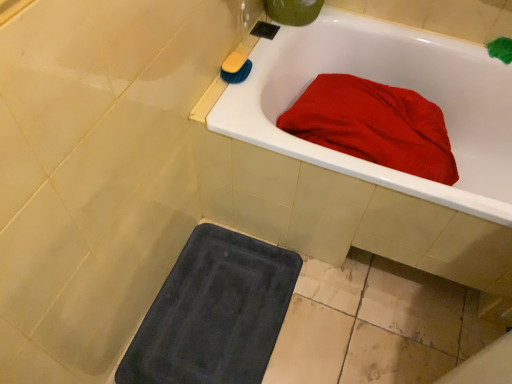
Identify the location of vacant area on the back side of yellow sponge at upper left. (254, 45).